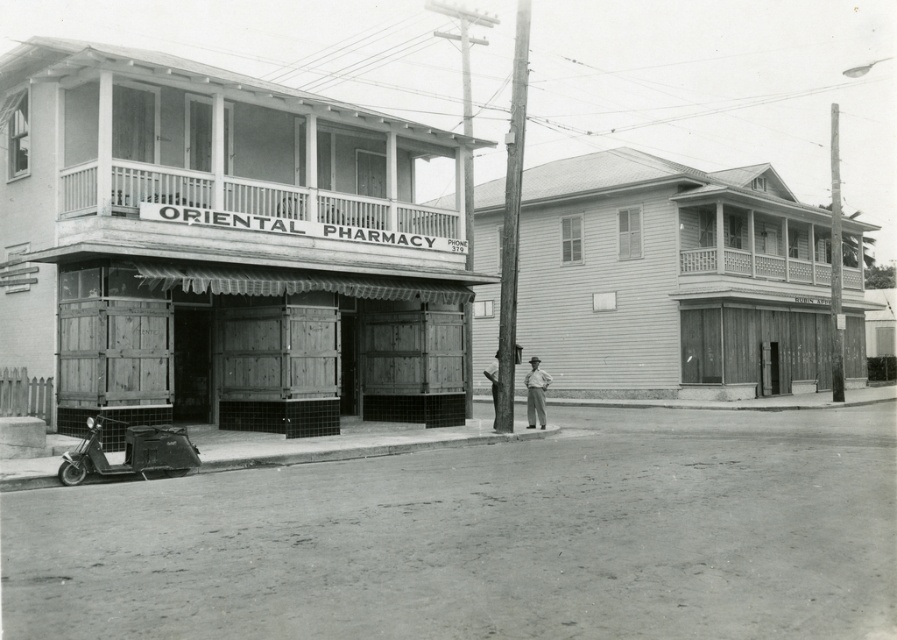
Does wooden/wooden-textured store at left have a greater height compared to wooden building at center?

No.

Does wooden/wooden-textured store at left appear under wooden building at center?

Incorrect, wooden/wooden-textured store at left is not positioned below wooden building at center.

Locate an element on the screen. This screenshot has height=640, width=897. wooden/wooden-textured store at left is located at coordinates (222, 248).

Find the location of a particular element. The height and width of the screenshot is (640, 897). wooden/wooden-textured store at left is located at coordinates (x=222, y=248).

Is metallic silver scooter at lower left further to the viewer compared to light brown wooden man at center?

No, it is in front of light brown wooden man at center.

Between point (170, 429) and point (494, 364), which one is positioned in front?

Point (170, 429)

The image size is (897, 640). I want to click on metallic silver scooter at lower left, so click(129, 452).

Who is shorter, wooden/wooden-textured store at left or smooth wooden pole at center right?

wooden/wooden-textured store at left is shorter.

Is point (279, 230) farther from camera compared to point (839, 182)?

No, (279, 230) is closer to viewer.

Locate an element on the screen. wooden/wooden-textured store at left is located at coordinates (222, 248).

The image size is (897, 640). What are the coordinates of `wooden/wooden-textured store at left` in the screenshot? It's located at (222, 248).